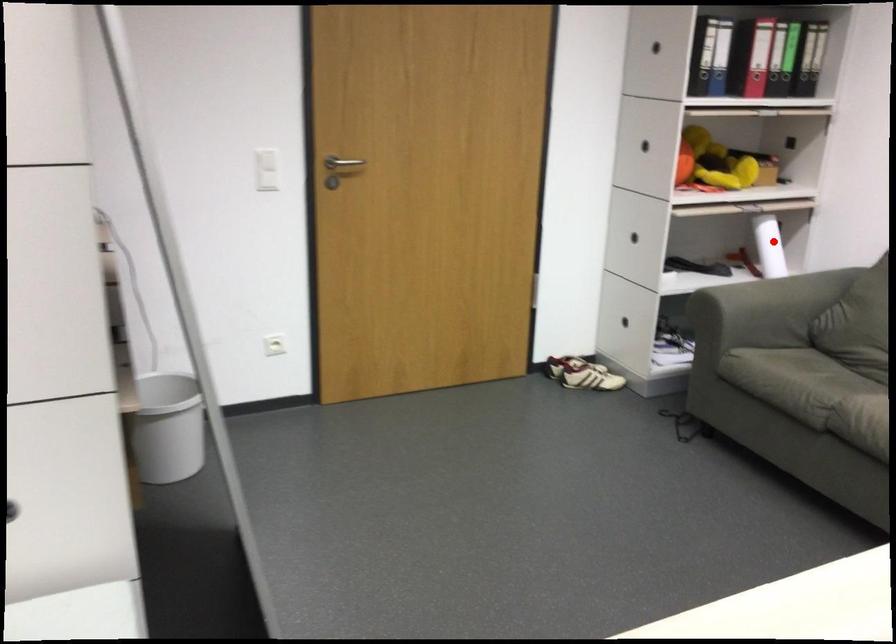
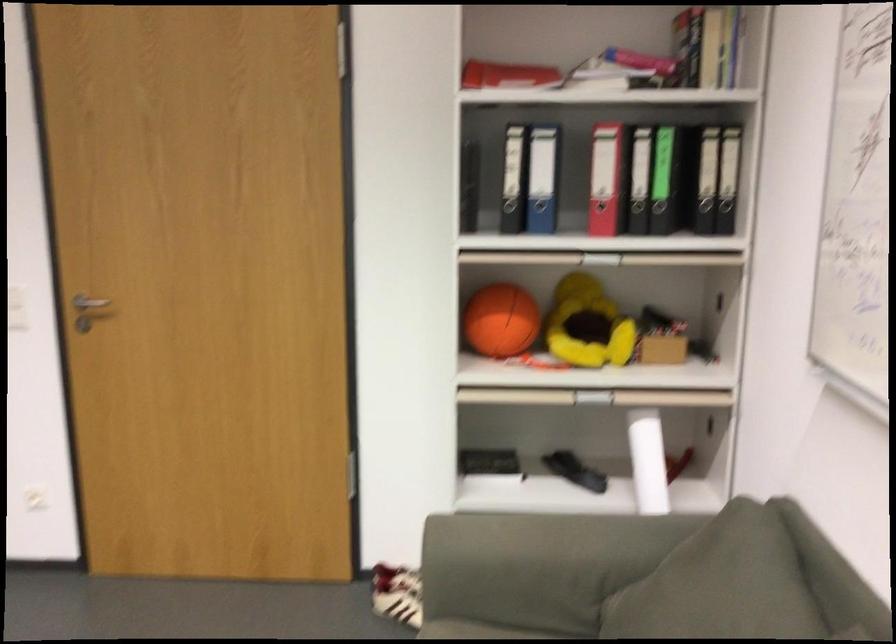
Question: A red point is marked in image1. In image2, is the corresponding 3D point closer to the camera or farther? Reply with the corresponding letter.

Choices:
 (A) The corresponding 3D point is closer.
 (B) The corresponding 3D point is farther.

Answer: (A)